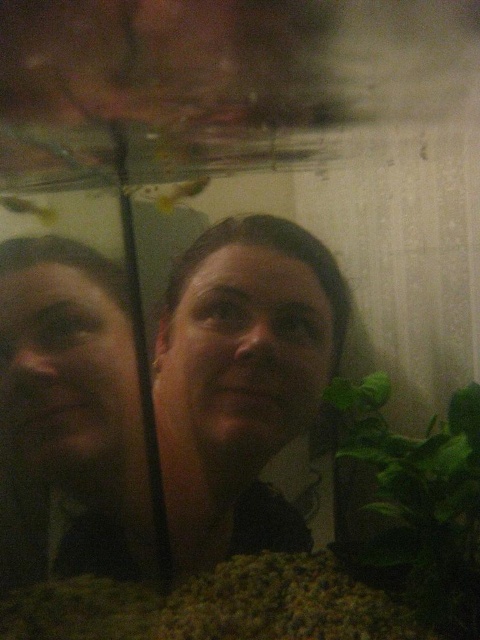
Can you confirm if matte black hair at center is positioned to the left of green leafy plant at lower right?

Correct, you'll find matte black hair at center to the left of green leafy plant at lower right.

Does matte black hair at center have a smaller size compared to green leafy plant at lower right?

Incorrect, matte black hair at center is not smaller in size than green leafy plant at lower right.

Is point (291, 298) positioned in front of point (432, 621)?

That is False.

The height and width of the screenshot is (640, 480). I want to click on matte black hair at center, so click(x=241, y=380).